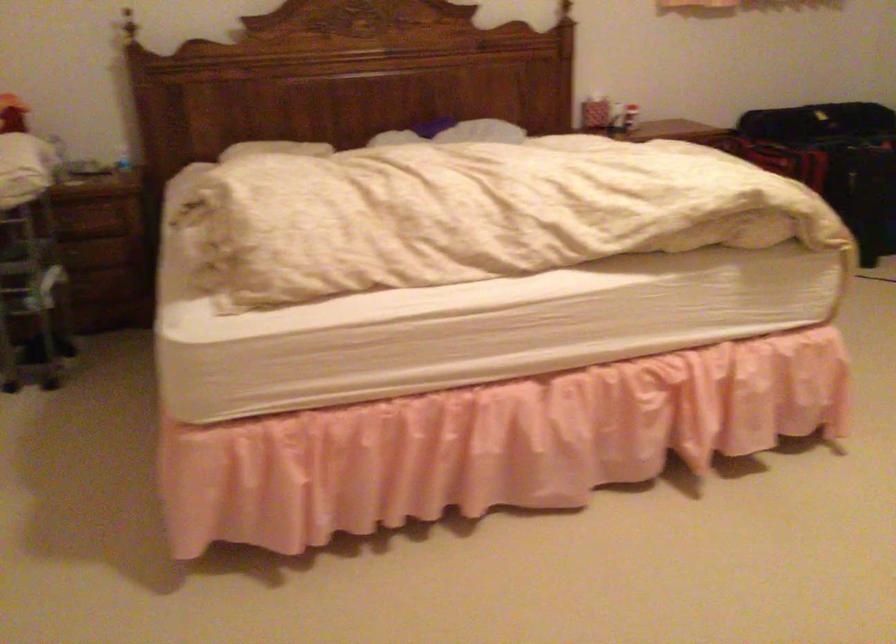
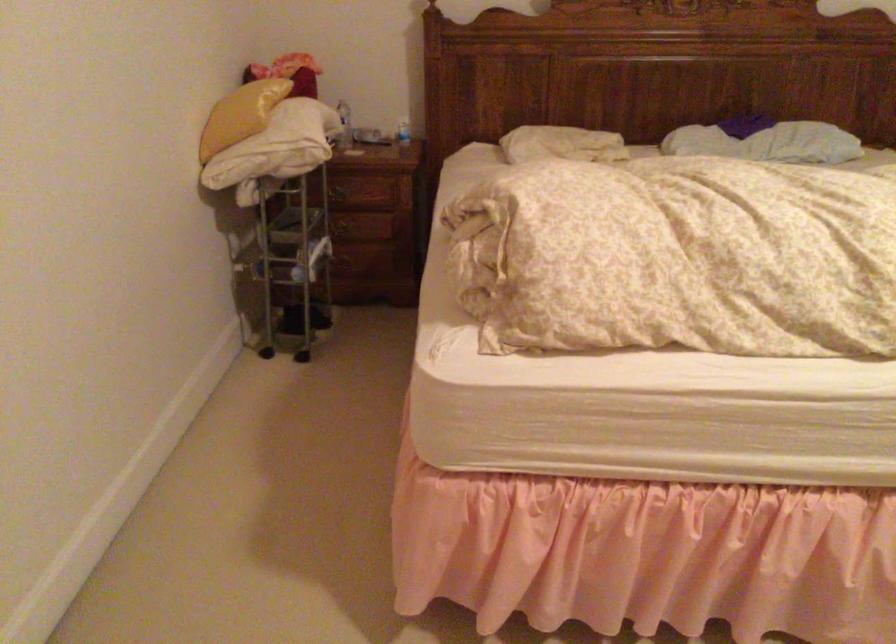
The point at (271, 149) is marked in the first image. Where is the corresponding point in the second image?

(561, 144)